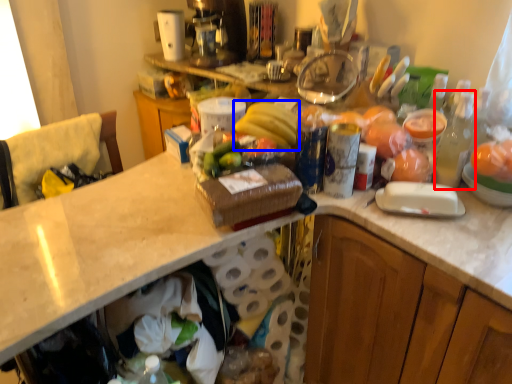
Question: Which object is closer to the camera taking this photo, bottle (highlighted by a red box) or banana (highlighted by a blue box)?

Choices:
 (A) bottle
 (B) banana

Answer: (A)